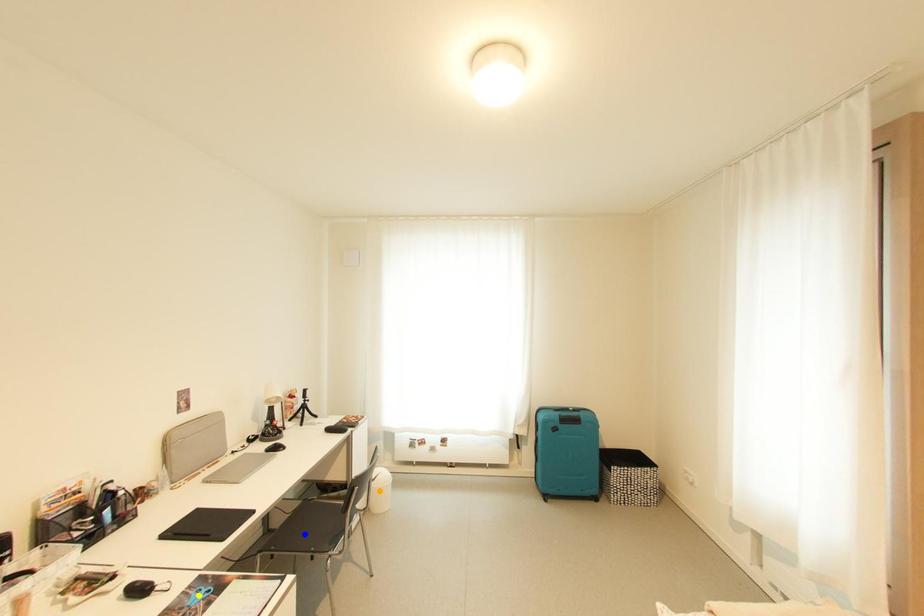
Order these from nearest to farthest:
yellow point, orange point, blue point

yellow point → blue point → orange point